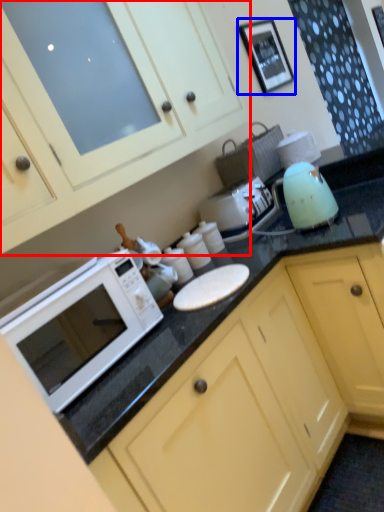
Question: Which point is closer to the camera, cabinetry (highlighted by a red box) or picture frame (highlighted by a blue box)?

Choices:
 (A) cabinetry
 (B) picture frame

Answer: (A)